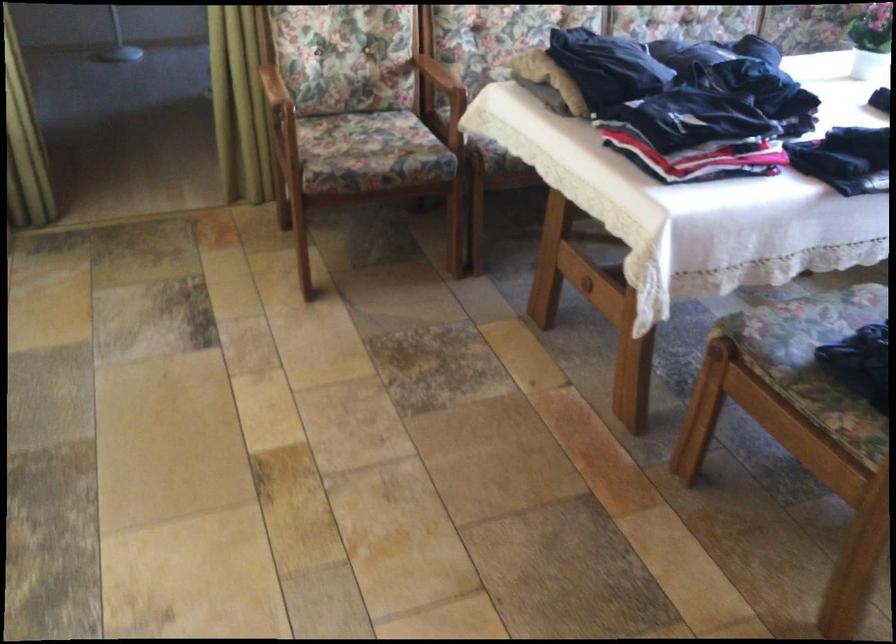
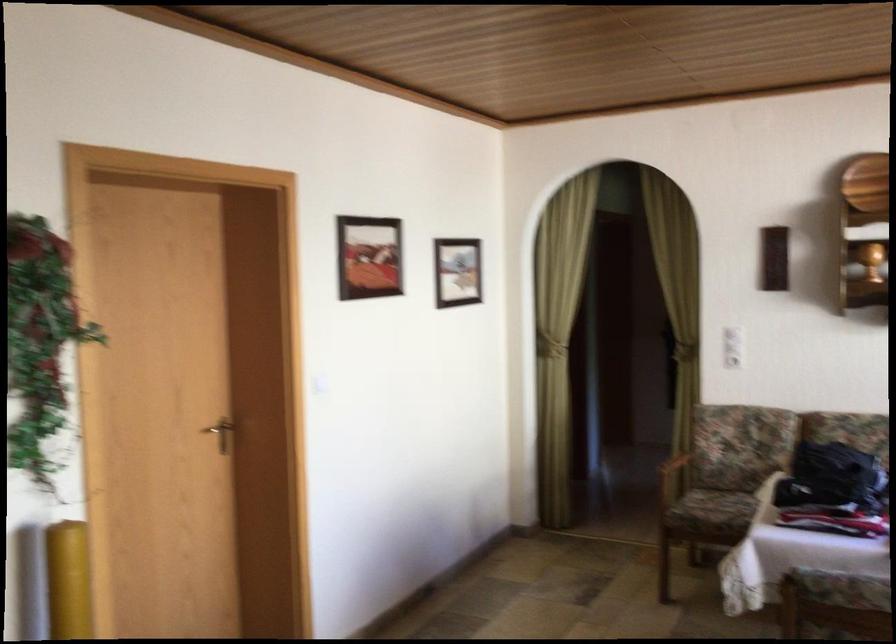
Locate, in the second image, the point that corresponds to (238,122) in the first image.

(672, 480)